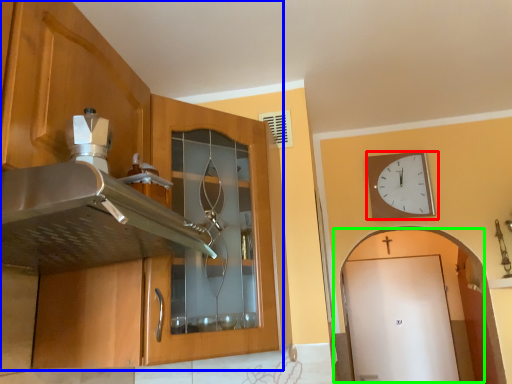
Question: Which object is the closest to the wall clock (highlighted by a red box)? Choose among these: cabinetry (highlighted by a blue box) or door (highlighted by a green box).

Choices:
 (A) cabinetry
 (B) door

Answer: (A)